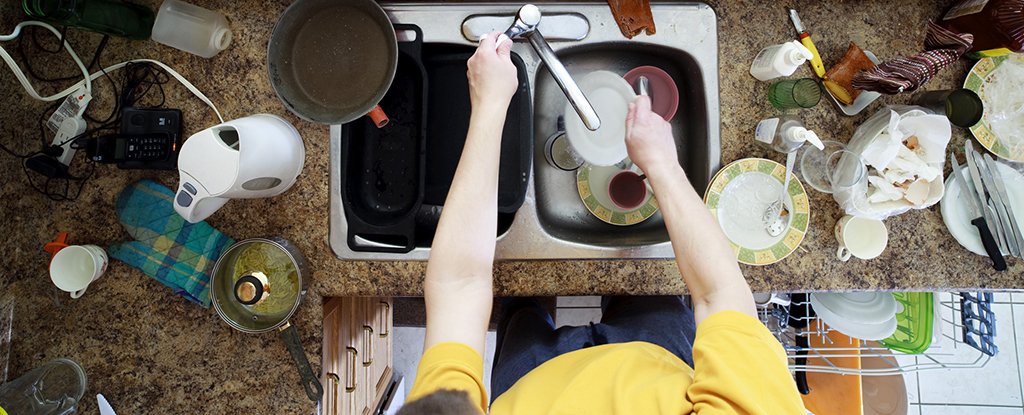
Identify the location of electric wires. (30, 92), (116, 94).